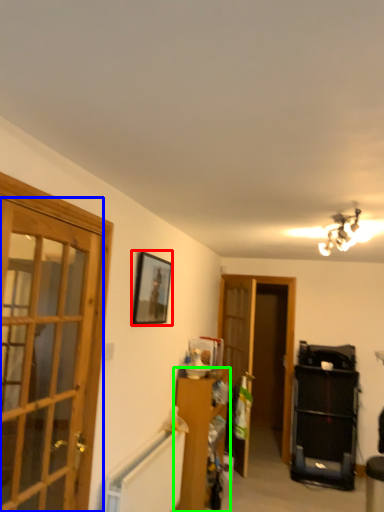
Question: Which object is the closest to the picture frame (highlighted by a red box)? Choose among these: door (highlighted by a blue box) or furniture (highlighted by a green box).

Choices:
 (A) door
 (B) furniture

Answer: (B)